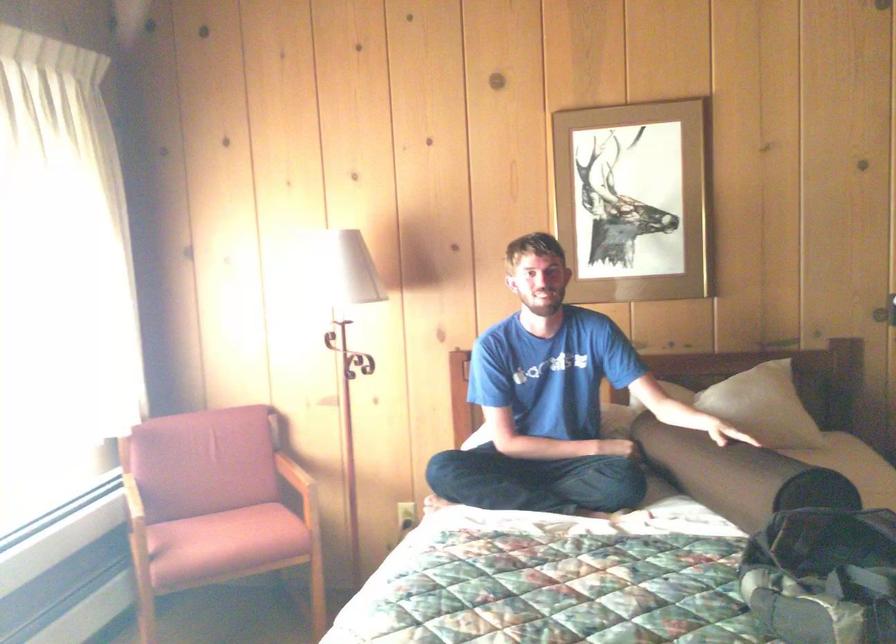
The image size is (896, 644). What do you see at coordinates (350, 269) in the screenshot?
I see `the white lampshade` at bounding box center [350, 269].